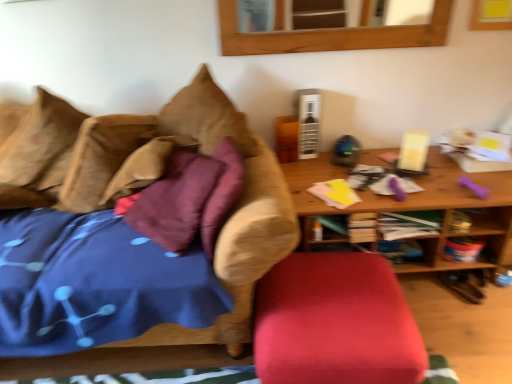
Question: Considering the positions of velvet red ottoman at lower center and wooden mirror at upper center in the image, is velvet red ottoman at lower center wider or thinner than wooden mirror at upper center?

Choices:
 (A) wide
 (B) thin

Answer: (A)

Question: Is velvet red ottoman at lower center bigger or smaller than wooden mirror at upper center?

Choices:
 (A) small
 (B) big

Answer: (B)

Question: Estimate the real-world distances between objects in this image. Which object is closer to the wooden mirror at upper center?

Choices:
 (A) velvet red ottoman at lower center
 (B) brown textured pillow at left, the second pillow from the right
 (C) brown suede pillow at upper left, marked as the 1th pillow in a right-to-left arrangement
 (D) wooden table at right
 (E) brown fabric couch at left

Answer: (D)

Question: Estimate the real-world distances between objects in this image. Which object is closer to the brown suede pillow at upper left, marked as the 1th pillow in a right-to-left arrangement?

Choices:
 (A) brown textured pillow at left, the second pillow from the right
 (B) brown fabric couch at left
 (C) velvet red ottoman at lower center
 (D) wooden table at right
 (E) wooden mirror at upper center

Answer: (A)